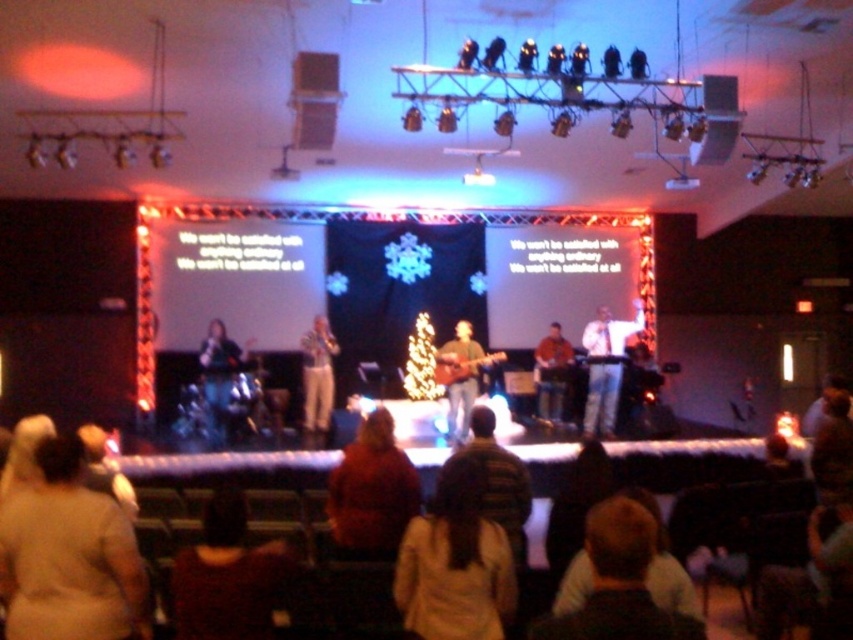
Is dark brown hair at lower center to the right of shiny silver drum set at left from the viewer's perspective?

Correct, you'll find dark brown hair at lower center to the right of shiny silver drum set at left.

Can you confirm if dark brown hair at lower center is positioned to the left of shiny silver drum set at left?

Incorrect, dark brown hair at lower center is not on the left side of shiny silver drum set at left.

Describe the element at coordinates (227, 577) in the screenshot. This screenshot has height=640, width=853. I see `dark brown hair at lower center` at that location.

The height and width of the screenshot is (640, 853). Find the location of `dark brown hair at lower center`. dark brown hair at lower center is located at coordinates coord(227,577).

Who is shorter, red velvet sweater at lower center or wooden acoustic guitar at center?

Standing shorter between the two is red velvet sweater at lower center.

Is red velvet sweater at lower center wider than wooden acoustic guitar at center?

No, red velvet sweater at lower center is not wider than wooden acoustic guitar at center.

Is point (395, 461) positioned behind point (460, 333)?

No, it is not.

I want to click on red velvet sweater at lower center, so click(370, 492).

Where is `dark brown hair at lower center`? The width and height of the screenshot is (853, 640). dark brown hair at lower center is located at coordinates (227, 577).

Between point (177, 577) and point (618, 330), which one is positioned in front?

Point (177, 577)

You are a GUI agent. You are given a task and a screenshot of the screen. Output one action in this format:
    pyautogui.click(x=<x>, y=<y>)
    Task: Click on the dark brown hair at lower center
    This screenshot has width=853, height=640.
    Given the screenshot: What is the action you would take?
    pyautogui.click(x=227, y=577)